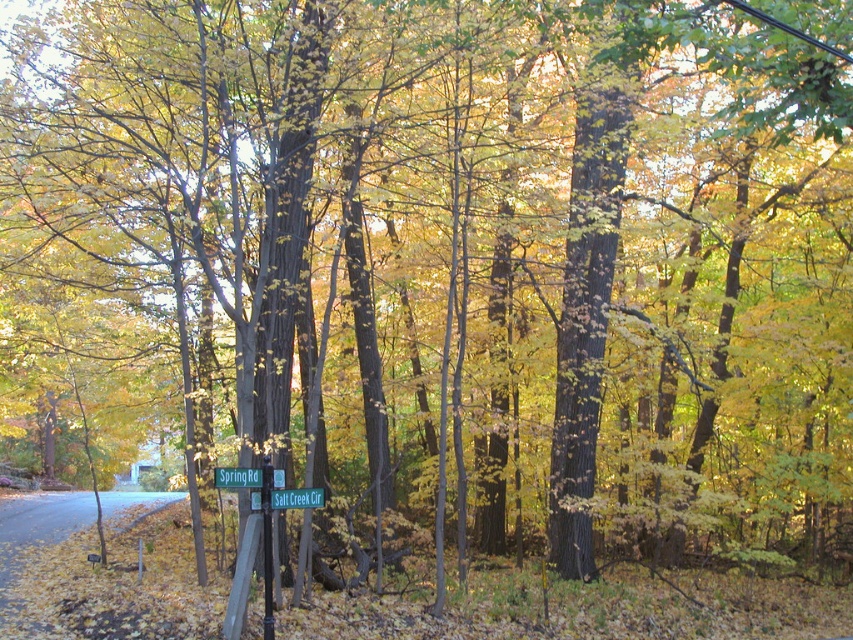
Based on the photo, can you confirm if metallic signpost at center is wider than green plastic street sign at center?

No, metallic signpost at center is not wider than green plastic street sign at center.

Is point (264, 616) less distant than point (271, 490)?

That is False.

Which is behind, point (270, 545) or point (306, 502)?

The point (306, 502) is behind.

You are a GUI agent. You are given a task and a screenshot of the screen. Output one action in this format:
    pyautogui.click(x=<x>, y=<y>)
    Task: Click on the metallic signpost at center
    
    Given the screenshot: What is the action you would take?
    pyautogui.click(x=267, y=547)

Does green plastic street sign at center have a greater width compared to green plastic sign at center?

Incorrect, green plastic street sign at center's width does not surpass green plastic sign at center's.

Between point (305, 496) and point (225, 468), which one is positioned in front?

Point (225, 468) is in front.

Is point (289, 497) closer to camera compared to point (233, 484)?

No, (289, 497) is behind (233, 484).

Where is `green plastic street sign at center`? green plastic street sign at center is located at coordinates (296, 497).

Which of these two, metallic signpost at center or green plastic sign at center, stands taller?

metallic signpost at center

Between metallic signpost at center and green plastic sign at center, which one appears on the right side from the viewer's perspective?

metallic signpost at center is more to the right.

Between point (265, 472) and point (247, 468), which one is positioned behind?

The point (265, 472) is more distant.

What are the coordinates of `metallic signpost at center` in the screenshot? It's located at (267, 547).